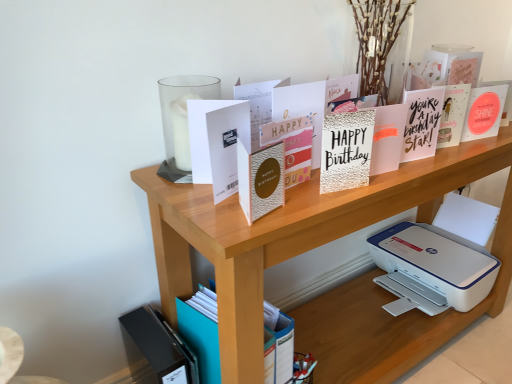
Where is `vacant area located to the right-hand side of silver glitter card at center, the 3th paperback book viewed from the right`? The height and width of the screenshot is (384, 512). vacant area located to the right-hand side of silver glitter card at center, the 3th paperback book viewed from the right is located at coordinates (398, 177).